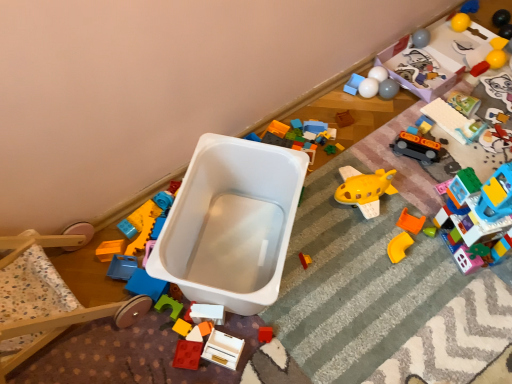
Identify the location of free space that is in between orange plastic block at lower right, the 7th toy when ordered from right to left, and translucent plastic building blocks at right, arranged as the 5th toy when viewed from the right. (428, 241).